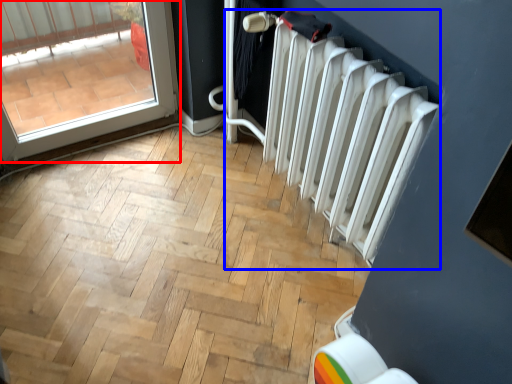
Question: Which object appears farthest to the camera in this image, door (highlighted by a red box) or radiator (highlighted by a blue box)?

Choices:
 (A) door
 (B) radiator

Answer: (A)